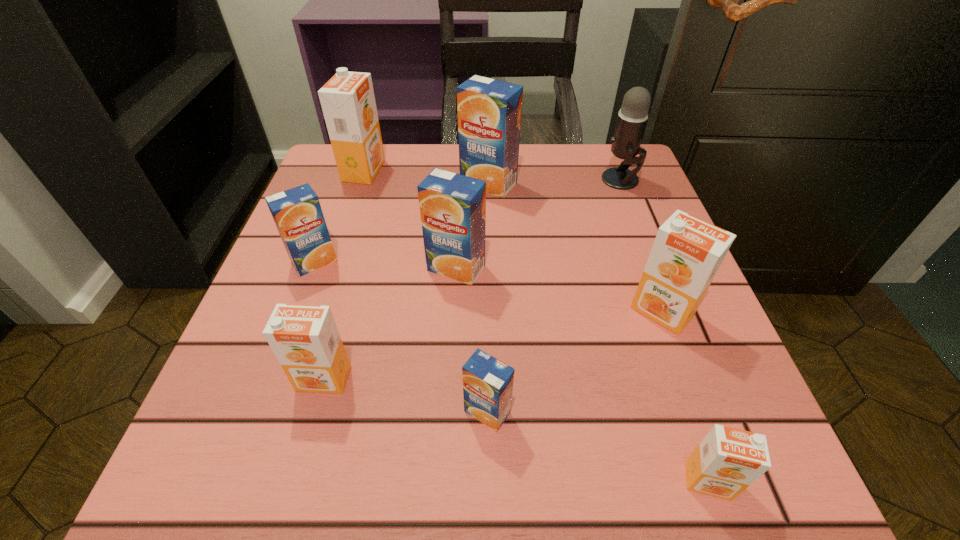
Where is `the smallest orange orange juice`? the smallest orange orange juice is located at coordinates (727, 461).

Locate an element on the screen. The height and width of the screenshot is (540, 960). vacant region located on the left of the farthest blue orange_juice is located at coordinates (383, 184).

Locate an element on the screen. This screenshot has height=540, width=960. vacant position located on the front of the farthest orange orange juice is located at coordinates (350, 210).

In order to click on vacant area situated on the left of the microphone in this screenshot , I will do `click(570, 180)`.

Where is `free space located on the front of the second biggest blue orange_juice`? free space located on the front of the second biggest blue orange_juice is located at coordinates (445, 477).

Identify the location of free space located on the back of the sixth farthest object. The height and width of the screenshot is (540, 960). (631, 225).

Locate an element on the screen. The width and height of the screenshot is (960, 540). vacant space located on the front of the leftmost blue orange_juice is located at coordinates (237, 468).

The image size is (960, 540). What are the coordinates of `free space located 0.060m on the right of the second smallest orange orange juice` in the screenshot? It's located at (390, 378).

Image resolution: width=960 pixels, height=540 pixels. What are the coordinates of `free space located on the back of the smallest blue orange_juice` in the screenshot? It's located at (485, 239).

The image size is (960, 540). Identify the location of vacant space located on the left of the smallest orange orange juice. (594, 481).